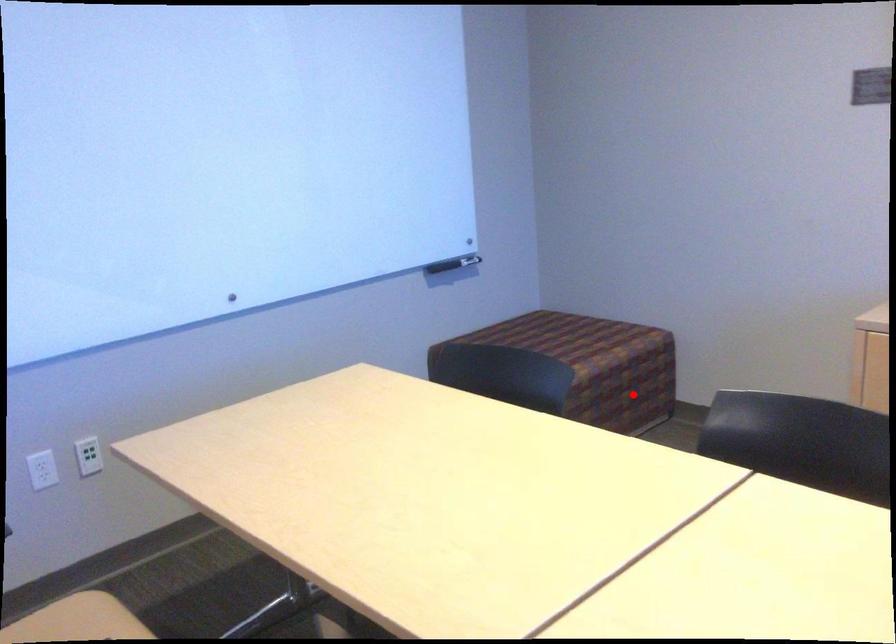
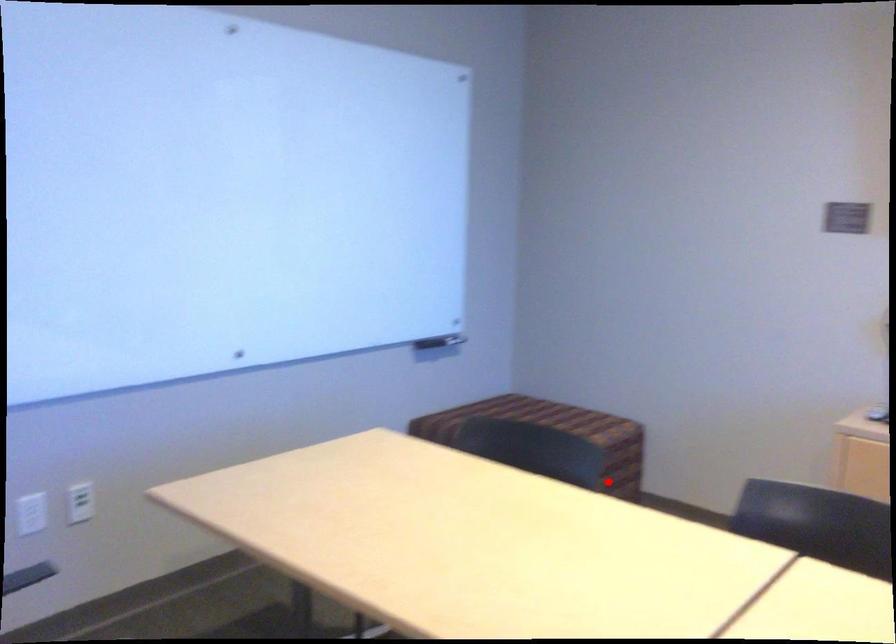
I am providing you with two images of the same scene from different viewpoints. A red point is marked on the first image and another point is marked on the second image. Is the red point in image1 aligned with the point shown in image2?

Yes